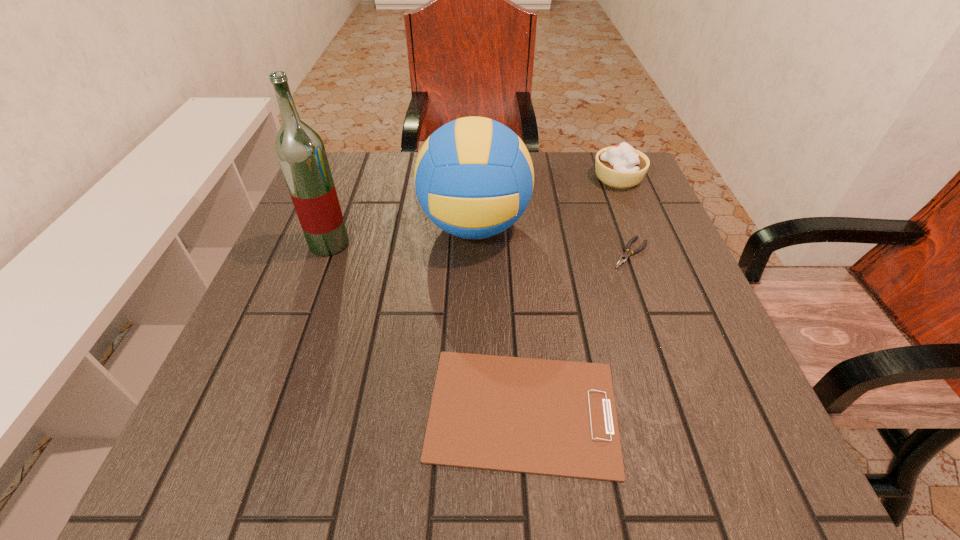
Where is `vacant area at the near edge of the desktop`? The height and width of the screenshot is (540, 960). vacant area at the near edge of the desktop is located at coordinates (350, 481).

Find the location of a particular element. The width and height of the screenshot is (960, 540). free space at the left edge of the desktop is located at coordinates (291, 254).

The image size is (960, 540). What are the coordinates of `blank space at the right edge of the desktop` in the screenshot? It's located at (715, 329).

Identify the location of vacant space at the far left corner of the desktop. The height and width of the screenshot is (540, 960). [x=372, y=169].

The height and width of the screenshot is (540, 960). Find the location of `free point between the volleyball and the clipboard`. free point between the volleyball and the clipboard is located at coordinates (499, 318).

Identify the location of free space between the leftmost object and the pliers. This screenshot has width=960, height=540. (480, 248).

At what (x,y) coordinates should I click in order to perform the action: click on free space between the pliers and the leftmost object. Please return your answer as a coordinate pair (x, y). The image size is (960, 540). Looking at the image, I should click on (480, 248).

I want to click on vacant space that's between the nearest object and the pliers, so click(x=577, y=332).

Image resolution: width=960 pixels, height=540 pixels. Identify the location of free space between the nearest object and the liquor. (426, 327).

The width and height of the screenshot is (960, 540). I want to click on vacant area between the clipboard and the volleyball, so tap(499, 318).